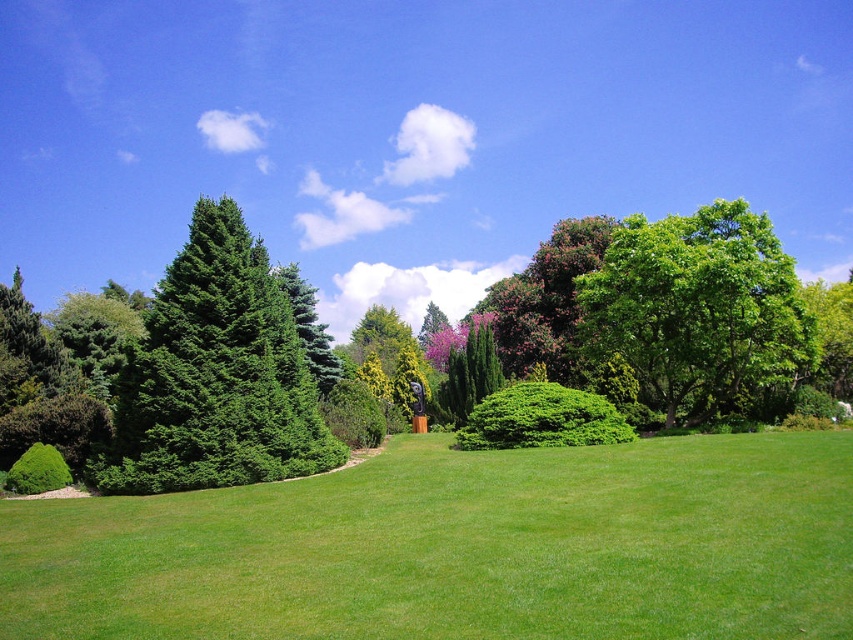
Question: Considering the real-world distances, which object is closest to the green glossy evergreen tree at left?

Choices:
 (A) green grass at center
 (B) green leafy bush at lower left

Answer: (B)

Question: Can you confirm if green glossy evergreen tree at left is thinner than green leafy bush at center?

Choices:
 (A) yes
 (B) no

Answer: (B)

Question: Which object appears closest to the camera in this image?

Choices:
 (A) green leafy tree at right
 (B) green glossy evergreen tree at left
 (C) green grass at center
 (D) green leafy bush at center

Answer: (C)

Question: Is green leafy bush at center smaller than green leafy bush at lower left?

Choices:
 (A) no
 (B) yes

Answer: (B)

Question: Which of the following is the closest to the observer?

Choices:
 (A) [x=331, y=436]
 (B) [x=537, y=397]
 (C) [x=624, y=285]
 (D) [x=486, y=586]

Answer: (D)

Question: Is green leafy tree at right below green leafy bush at center?

Choices:
 (A) no
 (B) yes

Answer: (A)